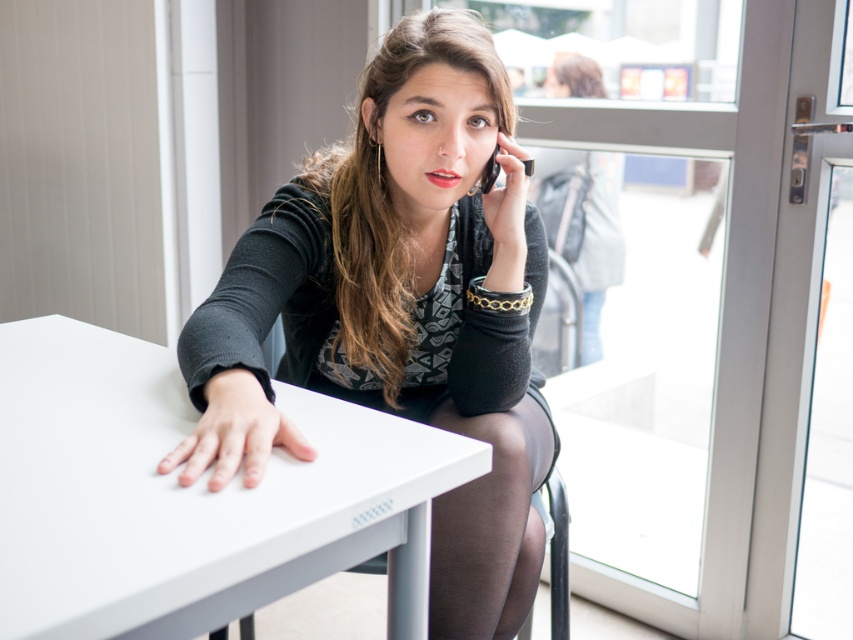
Identify the location of matte black sweater at center. This screenshot has width=853, height=640. (399, 308).

Who is more distant from viewer, (509, 545) or (351, 504)?

Point (509, 545)

Is point (296, 196) positioned before point (125, 636)?

No, (296, 196) is further to viewer.

Image resolution: width=853 pixels, height=640 pixels. I want to click on matte black sweater at center, so click(x=399, y=308).

Does matte black sweater at center have a smaller size compared to black plastic phone at upper center?

Actually, matte black sweater at center might be larger than black plastic phone at upper center.

Between matte black sweater at center and black plastic phone at upper center, which one appears on the right side from the viewer's perspective?

black plastic phone at upper center is more to the right.

Is point (395, 61) more distant than point (482, 188)?

No, (395, 61) is closer to viewer.

The width and height of the screenshot is (853, 640). Find the location of `matte black sweater at center`. matte black sweater at center is located at coordinates (399, 308).

Is white matte table at center wider than transparent glass door at upper center?

No.

Can you confirm if white matte table at center is positioned above transparent glass door at upper center?

Yes.

Does point (250, 500) come closer to viewer compared to point (650, 170)?

That is True.

Identify the location of white matte table at center. coord(190,497).